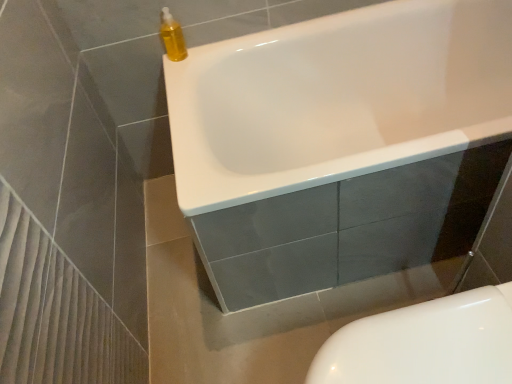
Question: Is white glossy toilet at lower right in front of or behind white glossy bathtub at upper center in the image?

Choices:
 (A) behind
 (B) front

Answer: (B)

Question: Is white glossy toilet at lower right taller or shorter than white glossy bathtub at upper center?

Choices:
 (A) tall
 (B) short

Answer: (B)

Question: Which is farther from the white glossy bathtub at upper center?

Choices:
 (A) white glossy toilet at lower right
 (B) yellow translucent bottle at upper left

Answer: (A)

Question: Which object is the closest to the yellow translucent bottle at upper left?

Choices:
 (A) white glossy bathtub at upper center
 (B) white glossy toilet at lower right

Answer: (A)